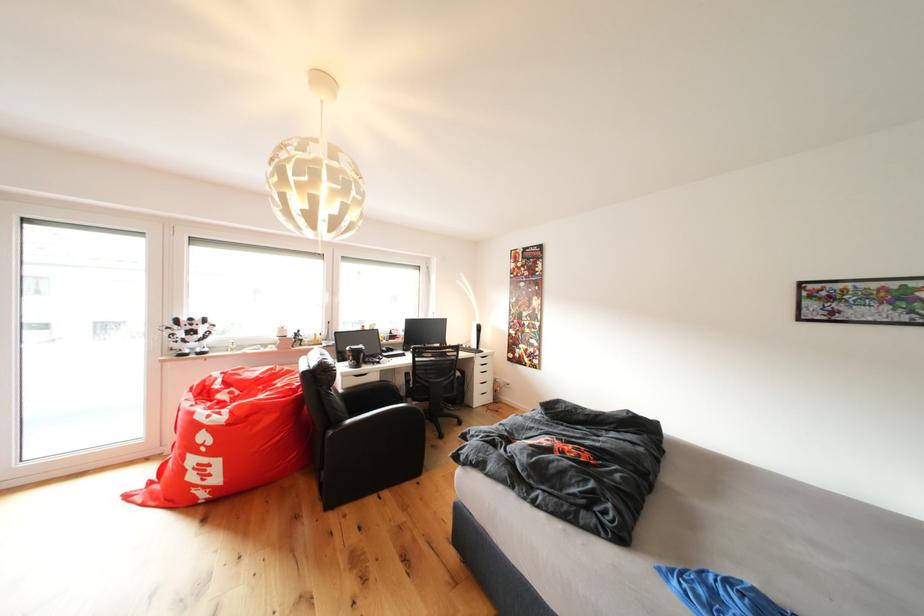
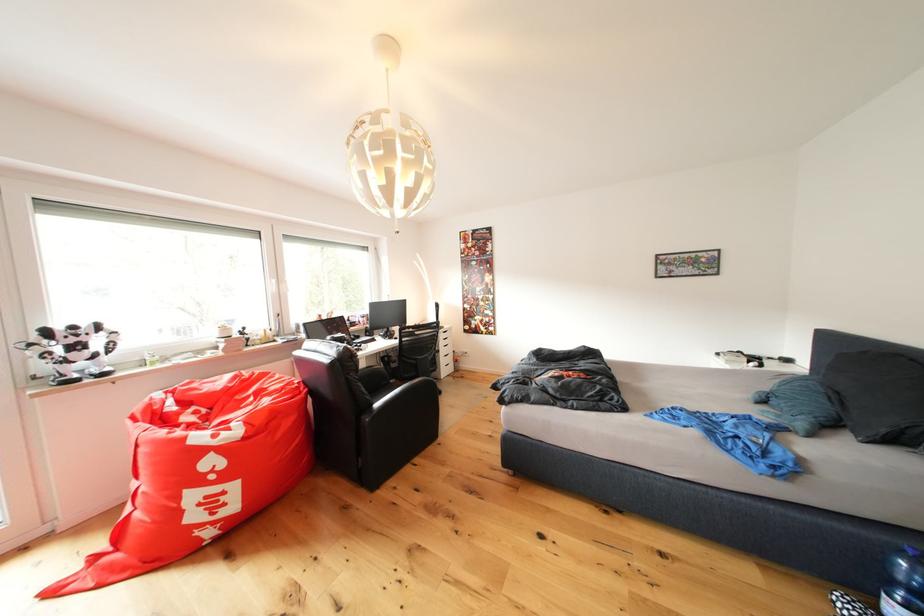
Question: What movement of the cameraman would produce the second image?

Choices:
 (A) Left
 (B) Right
 (C) Forward
 (D) Backward

Answer: (A)